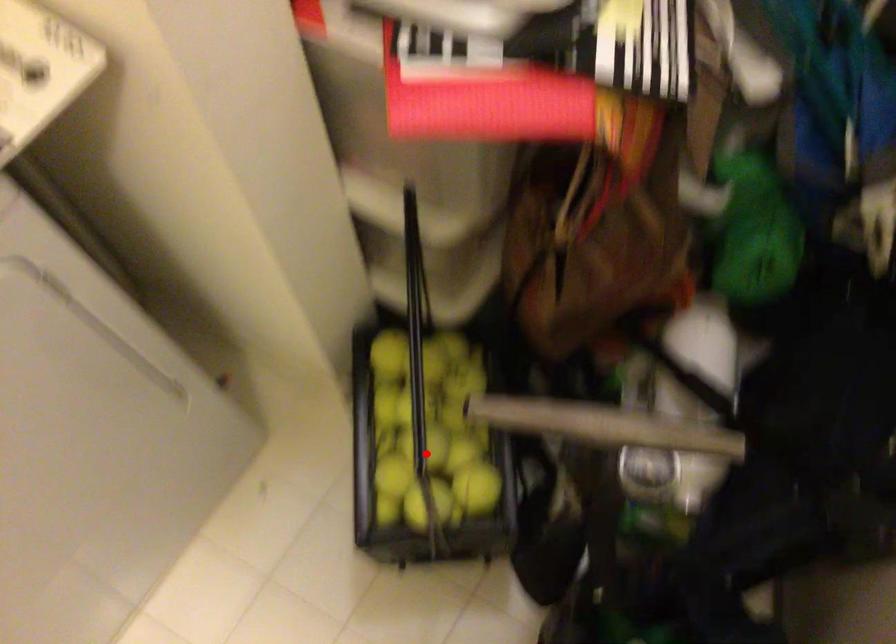
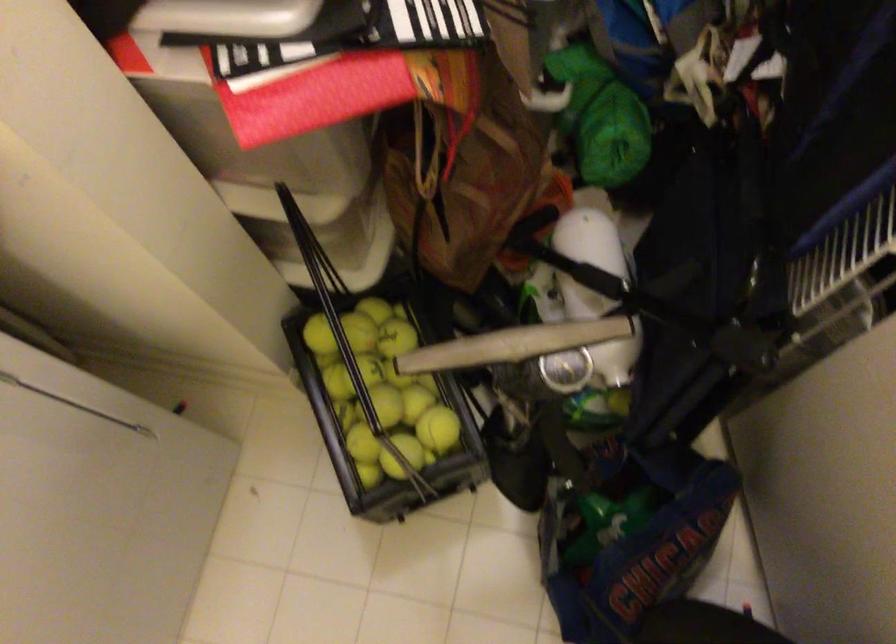
Find the pixel in the second image that matches the highlighted location in the first image.

(383, 408)